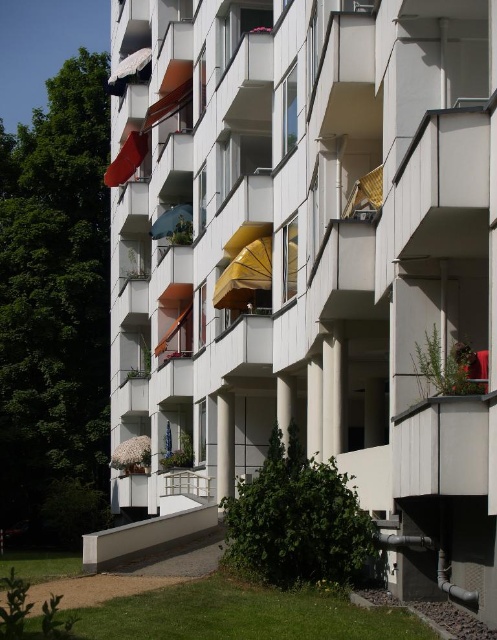
Question: Based on their relative distances, which object is farther from the blue fabric umbrella at center?

Choices:
 (A) white matte umbrella at upper left
 (B) yellow fabric umbrella at center
 (C) matte blue umbrella at center
 (D) matte red umbrella at upper left

Answer: (A)

Question: Which object is the closest to the yellow fabric umbrella at center?

Choices:
 (A) blue fabric umbrella at center
 (B) white matte umbrella at upper left
 (C) matte blue umbrella at center
 (D) matte red umbrella at upper left

Answer: (C)

Question: Which object appears farthest from the camera in this image?

Choices:
 (A) matte blue umbrella at center
 (B) white matte umbrella at upper left

Answer: (B)

Question: Can you confirm if matte red umbrella at upper left is positioned below blue fabric umbrella at center?

Choices:
 (A) yes
 (B) no

Answer: (B)

Question: Can you confirm if yellow fabric umbrella at center is positioned to the right of blue fabric umbrella at center?

Choices:
 (A) no
 (B) yes

Answer: (B)

Question: Is the position of yellow fabric umbrella at center more distant than that of blue fabric umbrella at center?

Choices:
 (A) yes
 (B) no

Answer: (B)